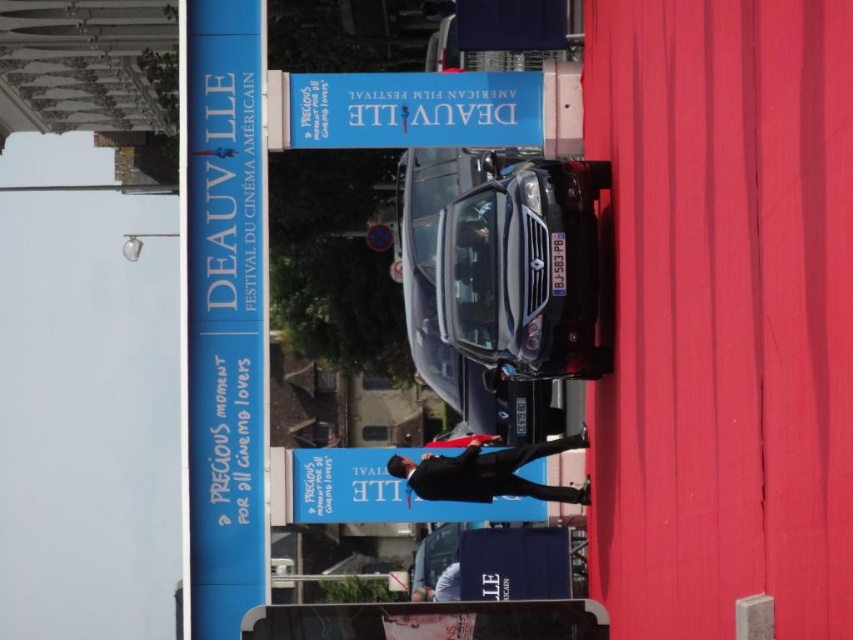
Question: Does blue plastic signboard at center come behind blue fabric sign at center?

Choices:
 (A) yes
 (B) no

Answer: (A)

Question: Is blue plastic signboard at center in front of blue fabric sign at center?

Choices:
 (A) no
 (B) yes

Answer: (A)

Question: Which point is closer to the camera?

Choices:
 (A) (354, 83)
 (B) (486, 515)

Answer: (B)

Question: Which point is farther to the camera?

Choices:
 (A) blue plastic signboard at center
 (B) blue fabric sign at center

Answer: (A)

Question: Is blue plastic signboard at center bigger than blue fabric sign at center?

Choices:
 (A) no
 (B) yes

Answer: (B)

Question: Which object is farther from the camera taking this photo?

Choices:
 (A) blue plastic signboard at center
 (B) blue fabric sign at center

Answer: (A)